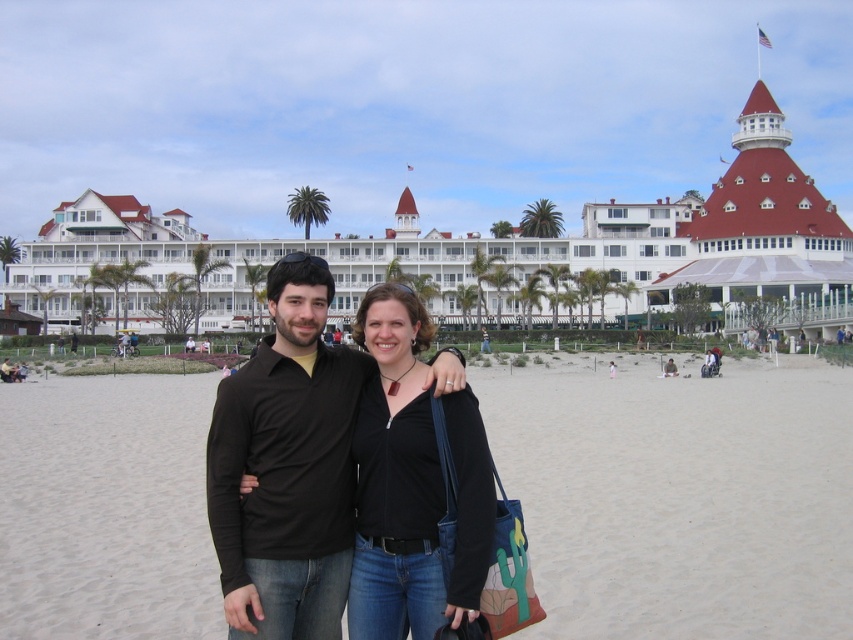
This screenshot has width=853, height=640. Describe the element at coordinates (680, 496) in the screenshot. I see `white sand at center` at that location.

Which is above, white sand at center or black matte shirt at center?

black matte shirt at center is above.

Does point (519, 456) come in front of point (311, 330)?

No, it is behind (311, 330).

Image resolution: width=853 pixels, height=640 pixels. Identify the location of white sand at center. (680, 496).

Locate an element on the screen. This screenshot has height=640, width=853. white sand at center is located at coordinates (680, 496).

Is white sand at center positioned in front of black matte jacket at center?

No, it is not.

Does point (685, 628) come closer to viewer compared to point (376, 289)?

Yes, it is.

The image size is (853, 640). In order to click on white sand at center in this screenshot , I will do `click(680, 496)`.

Between point (310, 272) and point (479, 500), which one is positioned in front?

Point (479, 500)

Between point (254, 532) and point (418, 305), which one is positioned behind?

Point (418, 305)

Is point (303, 536) closer to viewer compared to point (480, 456)?

Yes, it is.

Identify the location of black matte shirt at center. (286, 467).